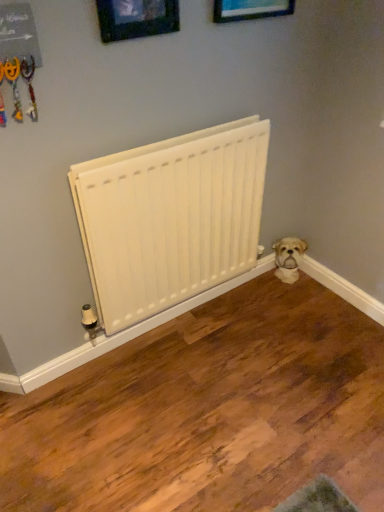
Question: From the image's perspective, relative to white matte radiator at center, is wooden picture frame at upper center, which appears as the 2th picture frame when viewed from the right, above or below?

Choices:
 (A) above
 (B) below

Answer: (A)

Question: Looking at the image, does wooden picture frame at upper center, the 1th picture frame in the left-to-right sequence, seem bigger or smaller compared to white matte radiator at center?

Choices:
 (A) small
 (B) big

Answer: (A)

Question: Estimate the real-world distances between objects in this image. Which object is closer to the wooden picture frame at upper center, arranged as the 2th picture frame when viewed from the left?

Choices:
 (A) wooden picture frame at upper center, which appears as the 2th picture frame when viewed from the right
 (B) white fluffy dog at lower right
 (C) white matte radiator at center

Answer: (A)

Question: Estimate the real-world distances between objects in this image. Which object is farther from the white fluffy dog at lower right?

Choices:
 (A) wooden picture frame at upper center, the 1th picture frame in the left-to-right sequence
 (B) wooden picture frame at upper center, which is the 1th picture frame from right to left
 (C) white matte radiator at center

Answer: (A)